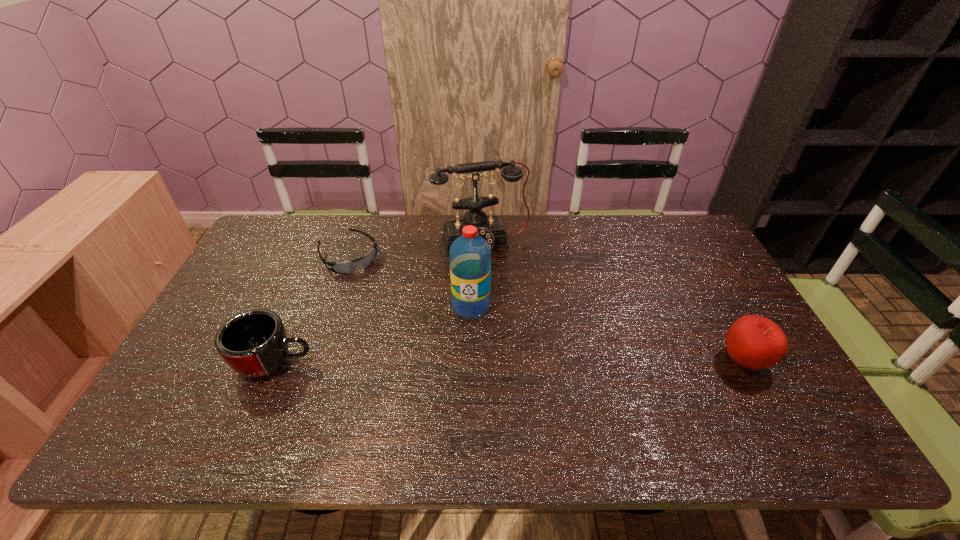
This screenshot has height=540, width=960. Find the location of `object positioned at the left edge`. object positioned at the left edge is located at coordinates (254, 344).

Find the location of a particular element. The image size is (960, 540). object located at the right edge is located at coordinates (753, 341).

The width and height of the screenshot is (960, 540). In order to click on object that is at the near left corner in this screenshot , I will do `click(254, 344)`.

The image size is (960, 540). What are the coordinates of `object present at the near right corner` in the screenshot? It's located at (753, 341).

In the image, there is a desktop. Find the location of `vacant area at the far edge`. vacant area at the far edge is located at coordinates (555, 222).

The height and width of the screenshot is (540, 960). Find the location of `vacant region at the near edge`. vacant region at the near edge is located at coordinates (484, 396).

The height and width of the screenshot is (540, 960). Identify the location of free space at the left edge of the desktop. (247, 271).

The height and width of the screenshot is (540, 960). In the image, there is a desktop. Find the location of `blank space at the right edge`. blank space at the right edge is located at coordinates (743, 308).

What are the coordinates of `free space at the far left corner of the desktop` in the screenshot? It's located at (299, 220).

You are a GUI agent. You are given a task and a screenshot of the screen. Output one action in this format:
    pyautogui.click(x=<x>, y=<y>)
    Task: Click on the vacant area at the far right corner
    This screenshot has width=960, height=540.
    Given the screenshot: What is the action you would take?
    pyautogui.click(x=705, y=251)